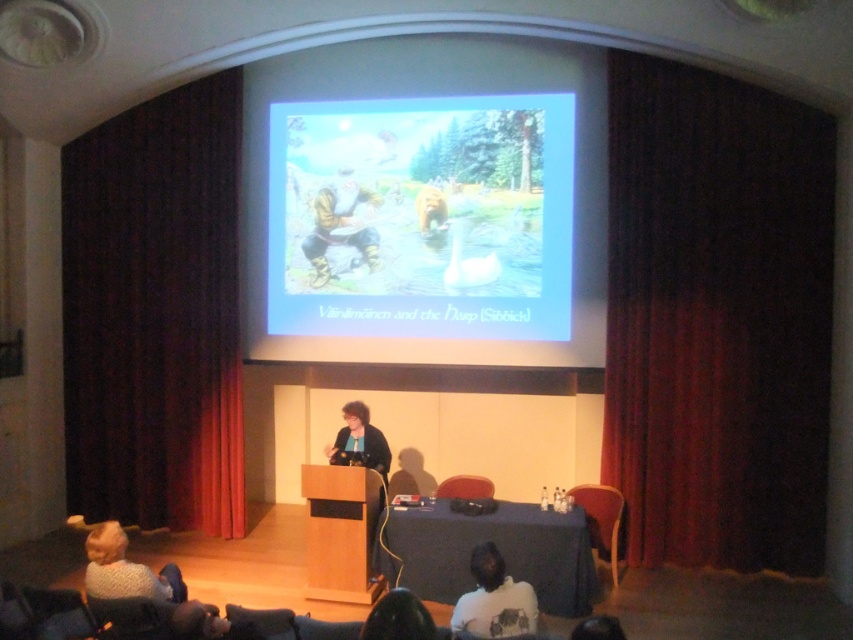
You are standing at the front of the room and want to adjust the focus of your camera to capture the matte digital image at center clearly. What distance should you set your camera to?

The matte digital image at center is 6.18 meters from camera, so you should set your camera to focus at 6.18 meters to capture it clearly.

You are attending a presentation and notice the dark red velvet curtain at left and the white matte shirt at lower center. Which object is taller?

The dark red velvet curtain at left is much taller than the white matte shirt at lower center.